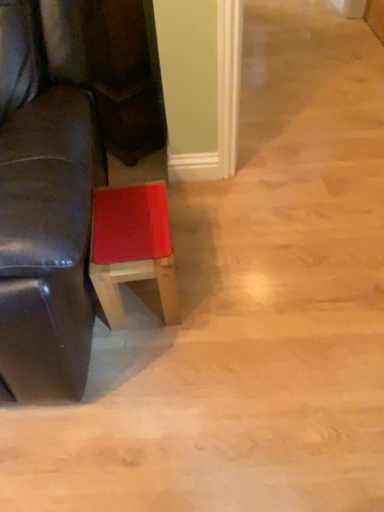
Where is `vacant space situated above matte red stool at lower center (from a real-world perspective)`? The width and height of the screenshot is (384, 512). vacant space situated above matte red stool at lower center (from a real-world perspective) is located at coordinates (125, 224).